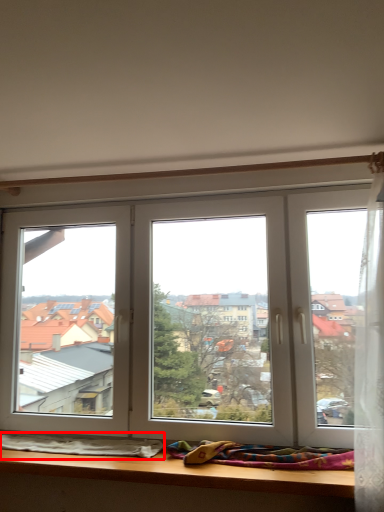
Question: From the image, what is the correct spatial relationship of blanket (annotated by the red box) in relation to blanket?

Choices:
 (A) left
 (B) right

Answer: (A)